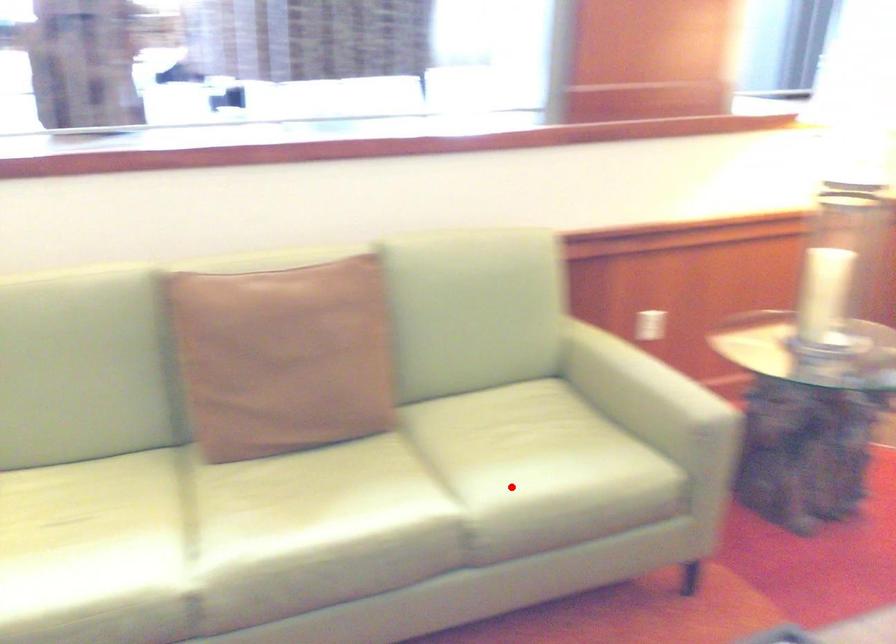
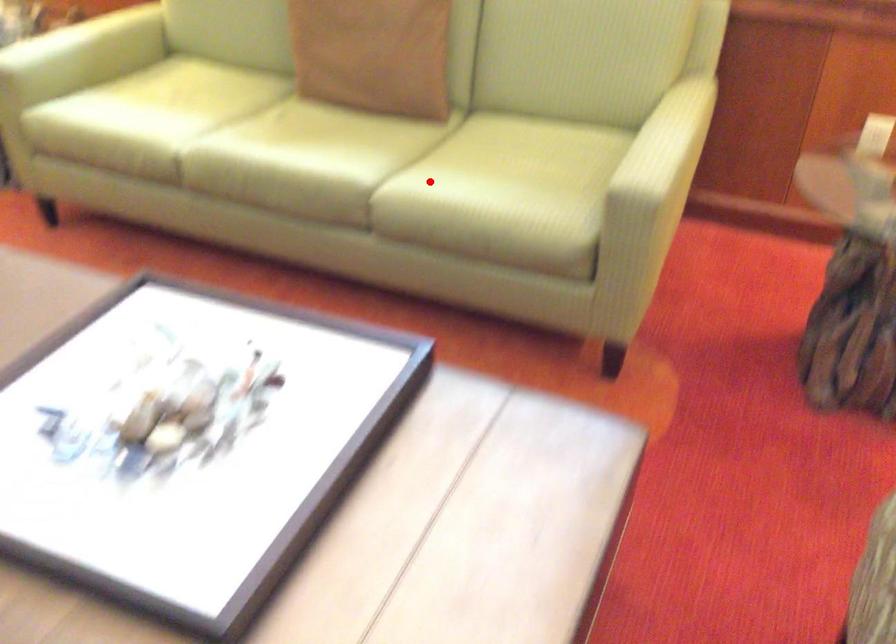
I am providing you with two images of the same scene from different viewpoints. A red point is marked on the first image and another point is marked on the second image. Is the red point in image1 aligned with the point shown in image2?

Yes